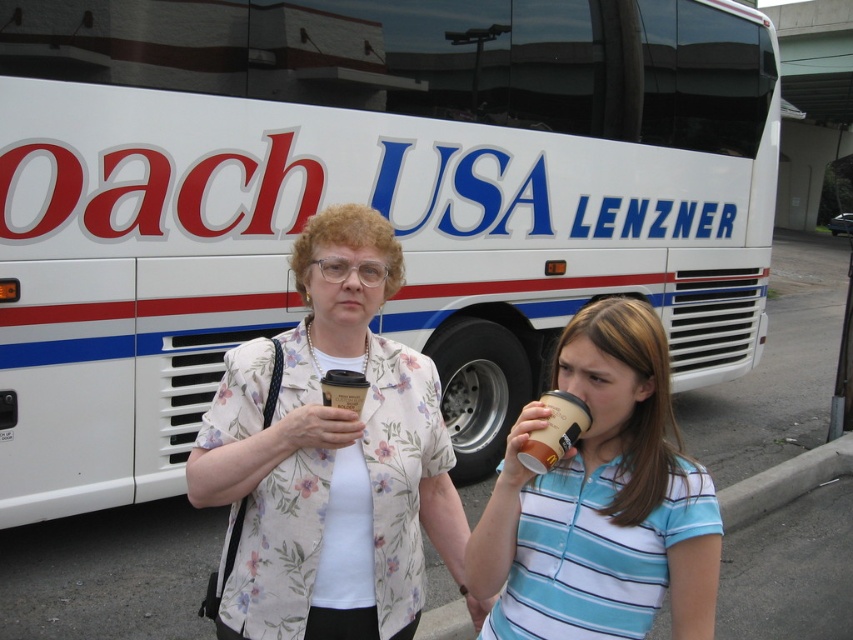
You are a photographer taking a picture of the two people in front of the Coach USA bus. You notice the floral fabric blouse at center and the brown paper cup at center. Which object should you focus on if you want to capture the larger item in your shot?

The floral fabric blouse at center is bigger than the brown paper cup at center, so you should focus on the floral fabric blouse at center to capture the larger item.